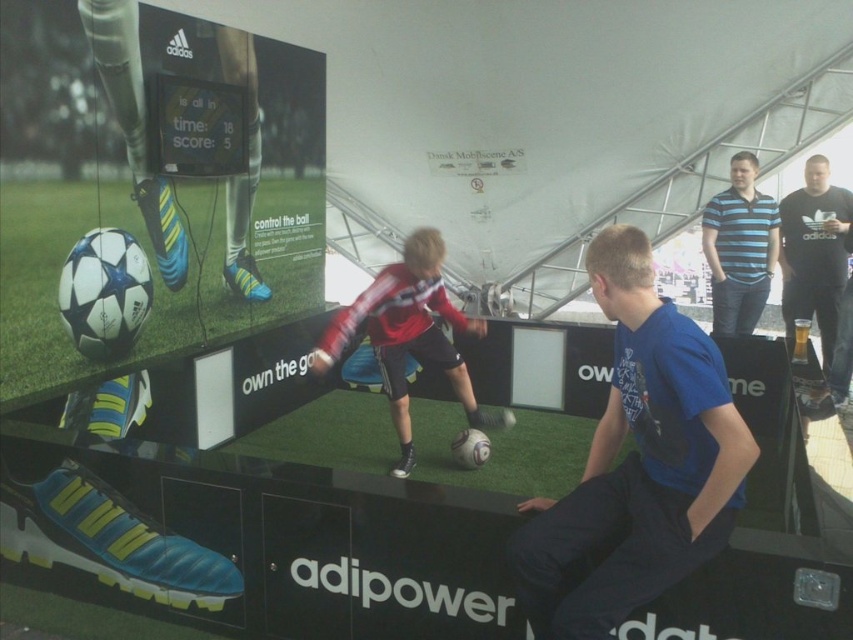
Question: Is blue cotton shirt at center thinner than blue striped polo shirt at upper right?

Choices:
 (A) yes
 (B) no

Answer: (B)

Question: Does blue cotton shirt at center appear under red striped shirt at center?

Choices:
 (A) no
 (B) yes

Answer: (B)

Question: Which object is positioned farthest from the red striped shirt at center?

Choices:
 (A) blue striped polo shirt at upper right
 (B) blue cotton shirt at center

Answer: (A)

Question: Which of the following is the closest to the observer?

Choices:
 (A) red striped shirt at center
 (B) black cotton shirt at upper right

Answer: (A)

Question: Can you confirm if blue cotton shirt at center is positioned to the left of black cotton shirt at upper right?

Choices:
 (A) no
 (B) yes

Answer: (B)

Question: Which point is farther to the camera?

Choices:
 (A) black cotton shirt at upper right
 (B) red striped shirt at center

Answer: (A)